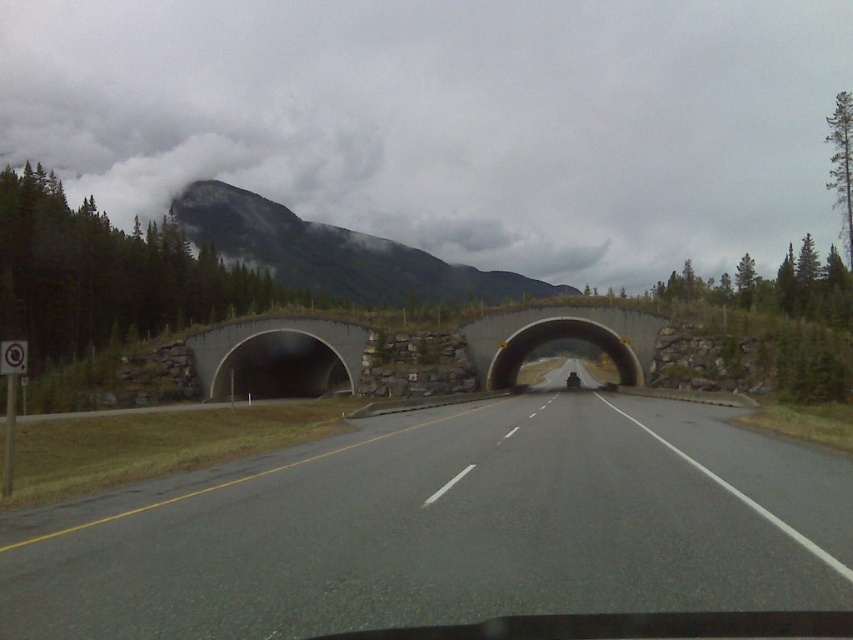
Question: Does gray asphalt road at center appear under rocky gray mountain at upper center?

Choices:
 (A) yes
 (B) no

Answer: (A)

Question: Can you confirm if gray asphalt road at center is smaller than concrete at center?

Choices:
 (A) no
 (B) yes

Answer: (A)

Question: Which of the following is the closest to the observer?

Choices:
 (A) rocky gray mountain at upper center
 (B) gray concrete tunnel at center
 (C) concrete at center
 (D) gray asphalt road at center

Answer: (D)

Question: Can you confirm if rocky gray mountain at upper center is positioned to the left of gray concrete tunnel at center?

Choices:
 (A) yes
 (B) no

Answer: (B)

Question: Which is farther from the gray concrete tunnel at center?

Choices:
 (A) concrete at center
 (B) rocky gray mountain at upper center

Answer: (B)

Question: Based on their relative distances, which object is farther from the concrete at center?

Choices:
 (A) gray concrete tunnel at center
 (B) rocky gray mountain at upper center

Answer: (B)